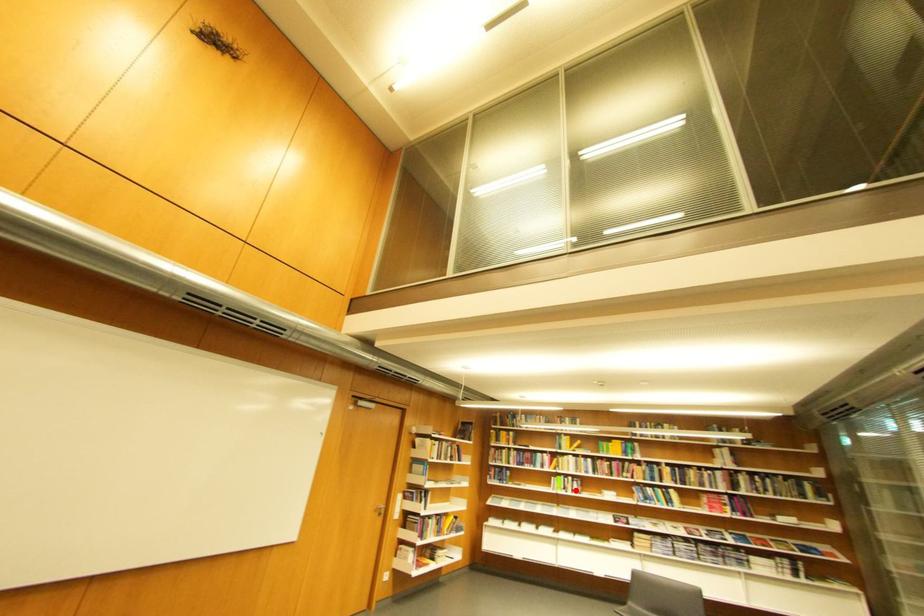
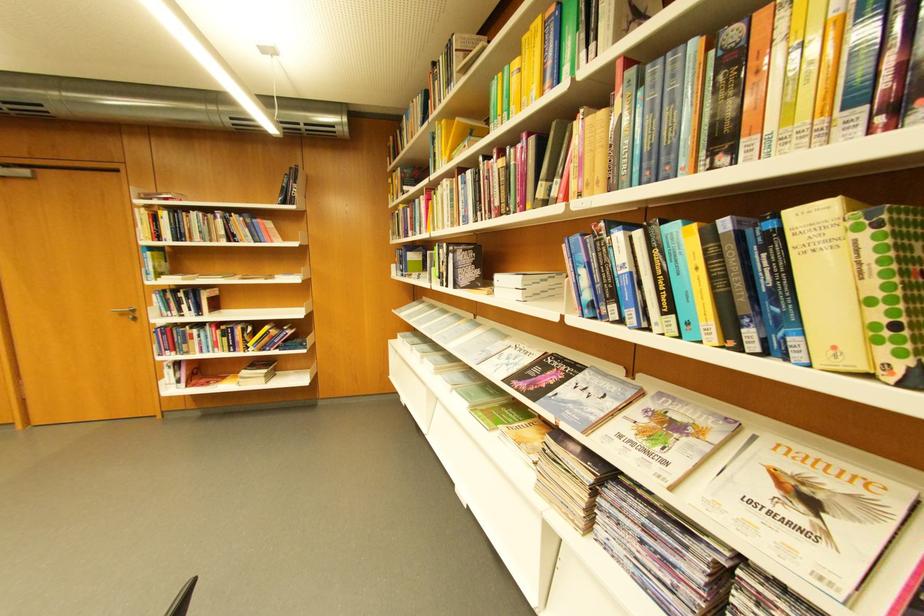
Question: I am providing you with two images of the same scene from different viewpoints. A red point is shown in image1. For the corresponding object point in image2, is it positioned nearer or farther from the camera?

Choices:
 (A) Nearer
 (B) Farther

Answer: (A)